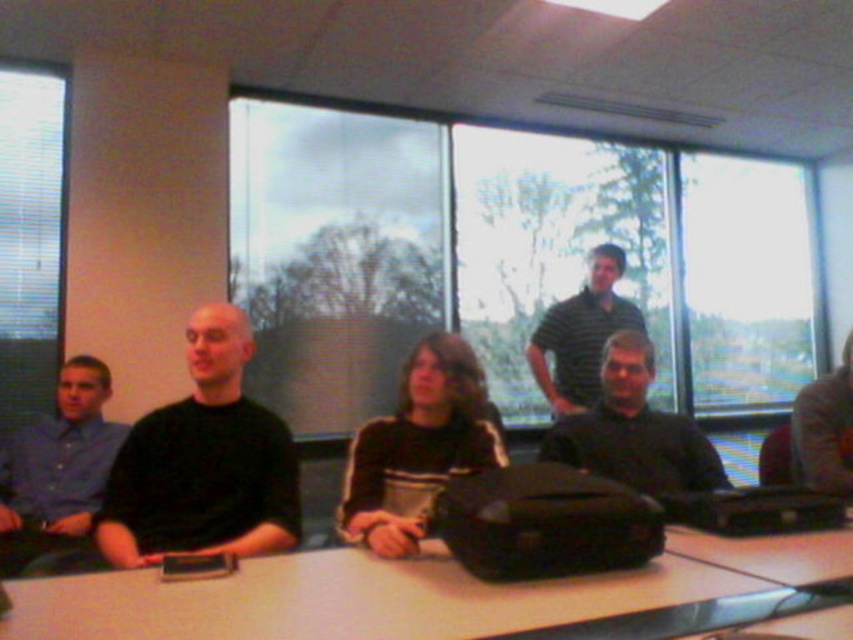
Question: Which point appears closest to the camera in this image?

Choices:
 (A) (143, 540)
 (B) (624, 348)

Answer: (A)

Question: Which of these objects is positioned closest to the white matte table at center?

Choices:
 (A) striped cotton shirt at center
 (B) dark gray shirt at center

Answer: (B)

Question: Does white matte table at center have a greater width compared to black matte shirt at left?

Choices:
 (A) no
 (B) yes

Answer: (B)

Question: Which object appears closest to the camera in this image?

Choices:
 (A) dark brown leather jacket at right
 (B) black matte shirt at left
 (C) white matte table at center
 (D) striped cotton shirt at center

Answer: (C)

Question: Where is black fabric bag at center located in relation to dark gray shirt at center in the image?

Choices:
 (A) below
 (B) above

Answer: (A)

Question: Does blue shirt at left appear under dark brown leather jacket at right?

Choices:
 (A) yes
 (B) no

Answer: (A)